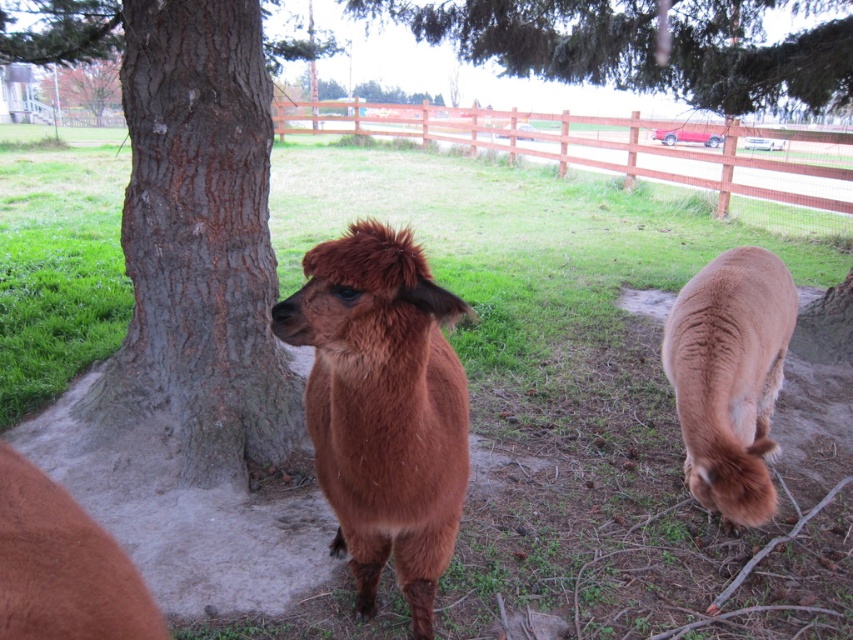
You are a photographer trying to capture both the green leafy tree at upper center and the brown woolen camel at lower right in the same frame. Based on their positions, which one should you adjust your camera angle to focus on first to ensure both are in the shot?

The green leafy tree at upper center is positioned on the right side of the brown woolen camel at lower right. To capture both in the same frame, you should first focus on the brown woolen camel at lower right and then adjust the camera angle to include the green leafy tree at upper center on its right side.

You are a photographer setting up a tripod to capture both the brown woolen camel at lower right and the brown wooden fence at upper center in the same frame. Based on their sizes, which object will appear smaller in the photo?

The brown woolen camel at lower right will appear smaller in the photo because it is shorter than the brown wooden fence at upper center.

You are a photographer standing at the edge of the grassy area. You want to take a photo that includes both the gray rough bark tree at center and the brown woolen camel at lower right. What is the minimum distance you need to move backward to ensure both are in frame?

The gray rough bark tree at center and the brown woolen camel at lower right are 2.06 meters apart from each other. To include both in the frame, you need to move back at least 2.06 meters to ensure the camera can capture the entire distance between them.